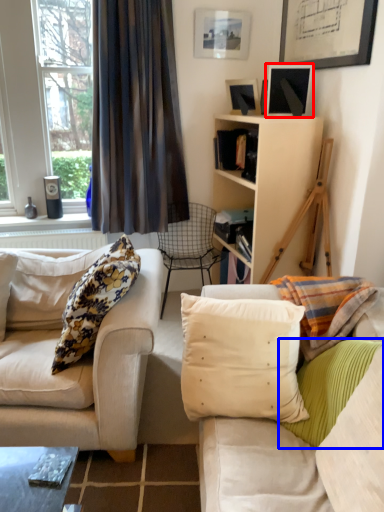
Question: Among these objects, which one is nearest to the camera, picture frame (highlighted by a red box) or pillow (highlighted by a blue box)?

Choices:
 (A) picture frame
 (B) pillow

Answer: (B)